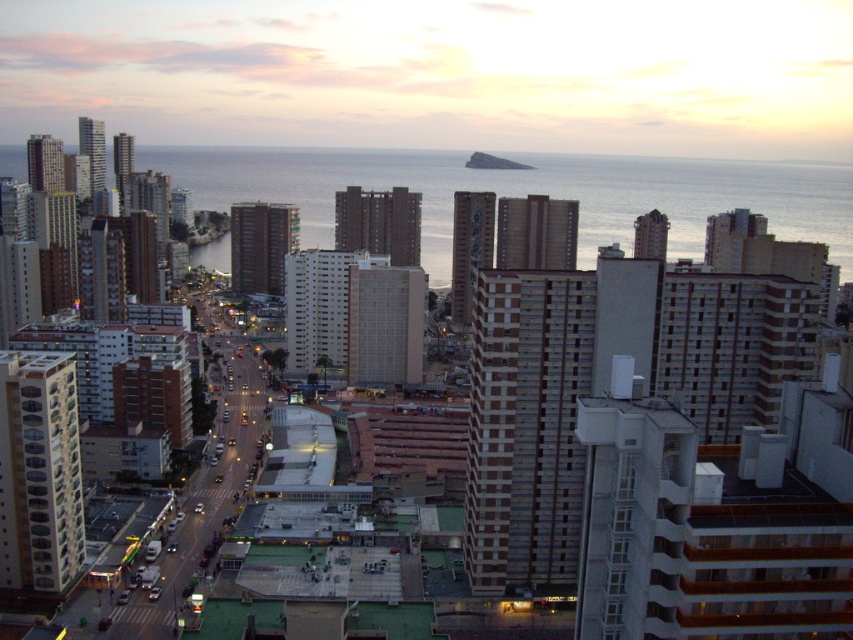
Question: Where is matte brown building at center located in relation to blue water at left in the image?

Choices:
 (A) below
 (B) above

Answer: (B)

Question: Is matte brown building at center to the right of blue water at left from the viewer's perspective?

Choices:
 (A) no
 (B) yes

Answer: (B)

Question: Does matte brown building at center come behind blue water at left?

Choices:
 (A) no
 (B) yes

Answer: (B)

Question: Which of the following is the closest to the observer?

Choices:
 (A) matte brown building at center
 (B) blue water at left

Answer: (B)